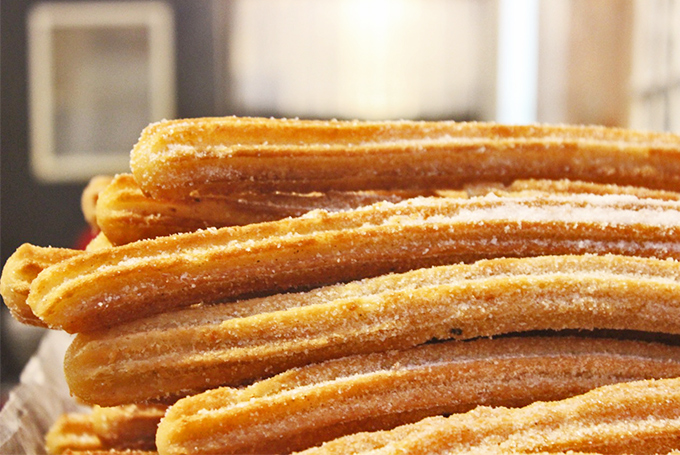
The width and height of the screenshot is (680, 455). I want to click on window panes, so click(x=653, y=117), click(x=655, y=55), click(x=677, y=51), click(x=675, y=112).